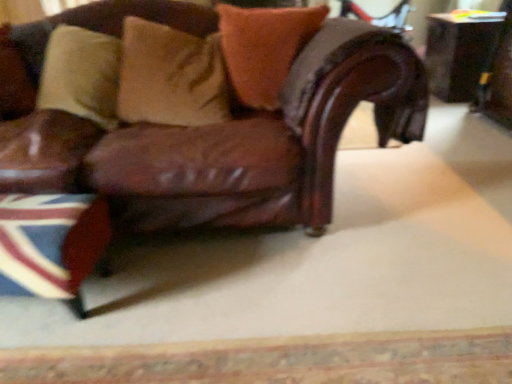
Question: Does brown leather pillow at upper left, the 3th pillow positioned from the right, have a larger size compared to suede-like beige pillow at upper center, positioned as the second pillow in left-to-right order?

Choices:
 (A) yes
 (B) no

Answer: (B)

Question: Would you consider brown leather pillow at upper left, the 3th pillow positioned from the right, to be distant from suede-like beige pillow at upper center, which is the 2th pillow in right-to-left order?

Choices:
 (A) no
 (B) yes

Answer: (A)

Question: Considering the relative sizes of brown leather pillow at upper left, the first pillow from the left, and suede-like beige pillow at upper center, which is the 2th pillow in right-to-left order, in the image provided, is brown leather pillow at upper left, the first pillow from the left, smaller than suede-like beige pillow at upper center, which is the 2th pillow in right-to-left order,?

Choices:
 (A) yes
 (B) no

Answer: (A)

Question: From the image's perspective, is brown leather pillow at upper left, the first pillow from the left, located above suede-like beige pillow at upper center, which is the 2th pillow in right-to-left order?

Choices:
 (A) yes
 (B) no

Answer: (A)

Question: Considering the relative sizes of brown leather pillow at upper left, the 3th pillow positioned from the right, and suede-like beige pillow at upper center, positioned as the second pillow in left-to-right order, in the image provided, is brown leather pillow at upper left, the 3th pillow positioned from the right, thinner than suede-like beige pillow at upper center, positioned as the second pillow in left-to-right order,?

Choices:
 (A) no
 (B) yes

Answer: (A)

Question: From the image's perspective, is wooden table at right located above or below suede-like beige pillow at upper center, which is the 2th pillow in right-to-left order?

Choices:
 (A) below
 (B) above

Answer: (B)

Question: In the image, is wooden table at right positioned in front of or behind suede-like beige pillow at upper center, positioned as the second pillow in left-to-right order?

Choices:
 (A) front
 (B) behind

Answer: (B)

Question: Based on their sizes in the image, would you say wooden table at right is bigger or smaller than suede-like beige pillow at upper center, which is the 2th pillow in right-to-left order?

Choices:
 (A) big
 (B) small

Answer: (A)

Question: Looking at their shapes, would you say wooden table at right is wider or thinner than suede-like beige pillow at upper center, which is the 2th pillow in right-to-left order?

Choices:
 (A) wide
 (B) thin

Answer: (A)

Question: Based on their positions, is velvet orange pillow at upper center, which is counted as the first pillow, starting from the right, located to the left or right of union jack fabric at lower left?

Choices:
 (A) left
 (B) right

Answer: (B)

Question: From the image's perspective, is velvet orange pillow at upper center, which is counted as the first pillow, starting from the right, above or below union jack fabric at lower left?

Choices:
 (A) above
 (B) below

Answer: (A)

Question: Considering the positions of velvet orange pillow at upper center, which is counted as the first pillow, starting from the right, and union jack fabric at lower left in the image, is velvet orange pillow at upper center, which is counted as the first pillow, starting from the right, bigger or smaller than union jack fabric at lower left?

Choices:
 (A) small
 (B) big

Answer: (B)

Question: Considering the positions of point (301, 18) and point (38, 231), is point (301, 18) closer or farther from the camera than point (38, 231)?

Choices:
 (A) farther
 (B) closer

Answer: (A)

Question: Based on their sizes in the image, would you say velvet orange pillow at upper center, which ranks as the third pillow in left-to-right order, is bigger or smaller than wooden table at right?

Choices:
 (A) big
 (B) small

Answer: (B)

Question: Is velvet orange pillow at upper center, which is counted as the first pillow, starting from the right, inside the boundaries of wooden table at right, or outside?

Choices:
 (A) outside
 (B) inside

Answer: (A)